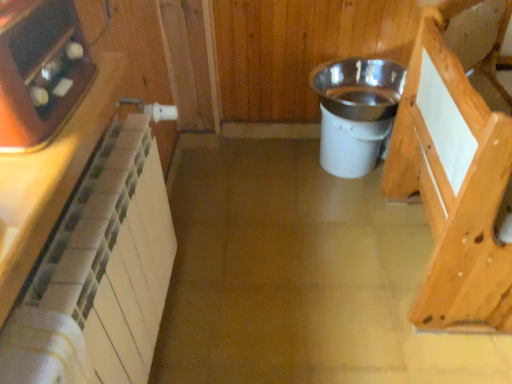
Question: Should I look upward or downward to see white tile cabinetry at left, placed as the second cabinetry when sorted from right to left?

Choices:
 (A) up
 (B) down

Answer: (A)

Question: Is white plastic bucket at center, which is counted as the 1th appliance, starting from the back, facing towards matte black tray at upper left, acting as the first appliance starting from the front?

Choices:
 (A) no
 (B) yes

Answer: (A)

Question: Considering the relative positions of white plastic bucket at center, marked as the 1th appliance in a right-to-left arrangement, and matte black tray at upper left, acting as the first appliance starting from the front, in the image provided, is white plastic bucket at center, marked as the 1th appliance in a right-to-left arrangement, in front of matte black tray at upper left, acting as the first appliance starting from the front,?

Choices:
 (A) yes
 (B) no

Answer: (B)

Question: Is white plastic bucket at center, marked as the 1th appliance in a right-to-left arrangement, far away from matte black tray at upper left, the 2th appliance from the right?

Choices:
 (A) yes
 (B) no

Answer: (A)

Question: Can you confirm if white plastic bucket at center, which is counted as the 1th appliance, starting from the back, is thinner than matte black tray at upper left, acting as the first appliance starting from the front?

Choices:
 (A) yes
 (B) no

Answer: (B)

Question: Is white plastic bucket at center, the second appliance in the left-to-right sequence, turned away from matte black tray at upper left, arranged as the first appliance when viewed from the left?

Choices:
 (A) no
 (B) yes

Answer: (A)

Question: Can you confirm if white plastic bucket at center, the 2th appliance when ordered from front to back, is positioned to the left of matte black tray at upper left, arranged as the second appliance when viewed from the back?

Choices:
 (A) no
 (B) yes

Answer: (A)

Question: Is light brown wood at right, acting as the 2th cabinetry starting from the front, bigger than white tile cabinetry at left, which ranks as the second cabinetry in back-to-front order?

Choices:
 (A) no
 (B) yes

Answer: (B)

Question: Is light brown wood at right, acting as the 2th cabinetry starting from the front, thinner than white tile cabinetry at left, placed as the second cabinetry when sorted from right to left?

Choices:
 (A) no
 (B) yes

Answer: (A)

Question: Does light brown wood at right, positioned as the 1th cabinetry in back-to-front order, have a smaller size compared to white tile cabinetry at left, placed as the second cabinetry when sorted from right to left?

Choices:
 (A) no
 (B) yes

Answer: (A)

Question: From the image's perspective, does light brown wood at right, which ranks as the second cabinetry in left-to-right order, appear higher than white tile cabinetry at left, placed as the 1th cabinetry when sorted from front to back?

Choices:
 (A) yes
 (B) no

Answer: (A)

Question: Is light brown wood at right, positioned as the 1th cabinetry in back-to-front order, oriented towards white tile cabinetry at left, placed as the 1th cabinetry when sorted from front to back?

Choices:
 (A) no
 (B) yes

Answer: (A)

Question: Is white tile cabinetry at left, placed as the second cabinetry when sorted from right to left, located within light brown wood at right, the 1th cabinetry viewed from the right?

Choices:
 (A) yes
 (B) no

Answer: (B)

Question: Is matte black tray at upper left, acting as the first appliance starting from the front, smaller than white tile cabinetry at left, which ranks as the second cabinetry in back-to-front order?

Choices:
 (A) no
 (B) yes

Answer: (B)